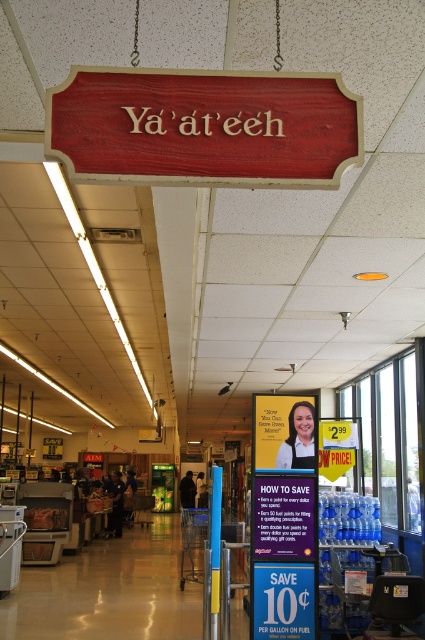
Question: Which point is farther to the camera?

Choices:
 (A) (207, 150)
 (B) (277, 436)
 (C) (283, 540)
 (D) (294, 563)

Answer: (B)

Question: Which object appears closest to the camera in this image?

Choices:
 (A) blue plastic sign at center
 (B) blue paper sign at center
 (C) wooden sign at upper center

Answer: (C)

Question: Is blue paper sign at center to the right of yellow paper sign at center from the viewer's perspective?

Choices:
 (A) no
 (B) yes

Answer: (A)

Question: Which of the following is the closest to the observer?

Choices:
 (A) blue paper sign at center
 (B) wooden sign at upper center

Answer: (B)

Question: Is wooden sign at upper center positioned in front of blue plastic sign at center?

Choices:
 (A) yes
 (B) no

Answer: (A)

Question: Is blue plastic sign at center closer to camera compared to yellow paper sign at center?

Choices:
 (A) no
 (B) yes

Answer: (B)